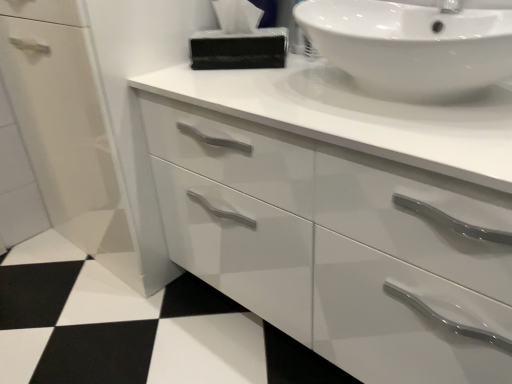
This screenshot has height=384, width=512. What are the coordinates of `vacant area situated to the left side of black glossy tissue at upper center` in the screenshot? It's located at (166, 71).